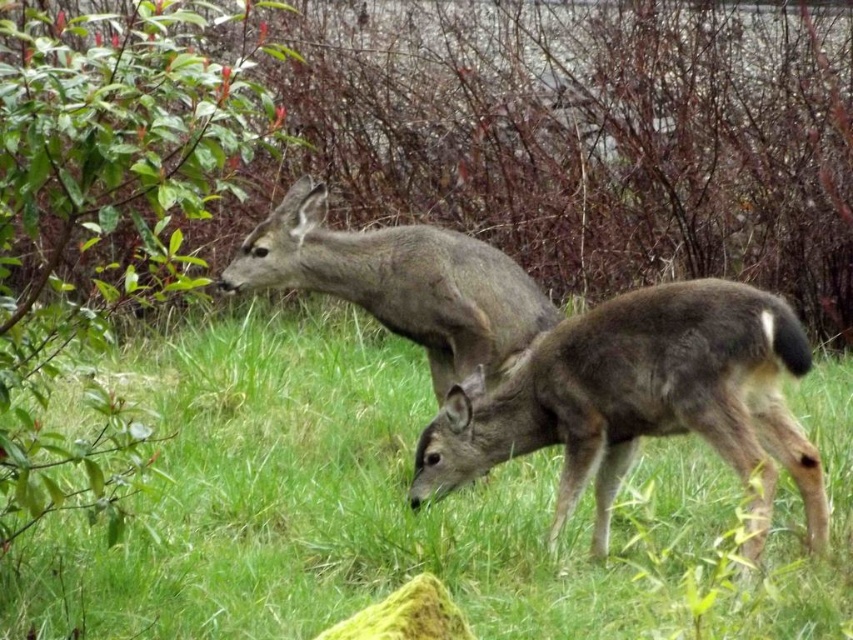
Question: Is green grassy at center behind brown fur roe deer at center?

Choices:
 (A) yes
 (B) no

Answer: (B)

Question: Among these objects, which one is nearest to the camera?

Choices:
 (A) gray fur roe deer at center
 (B) brown fur roe deer at center
 (C) green grassy at center

Answer: (C)

Question: Which of the following is the farthest from the observer?

Choices:
 (A) (757, 346)
 (B) (358, 428)
 (C) (469, 250)

Answer: (B)

Question: Considering the relative positions of green grassy at center and brown fur roe deer at center in the image provided, where is green grassy at center located with respect to brown fur roe deer at center?

Choices:
 (A) above
 (B) below

Answer: (A)

Question: Considering the real-world distances, which object is farthest from the green grassy at center?

Choices:
 (A) gray fur roe deer at center
 (B) brown fur roe deer at center

Answer: (A)

Question: From the image, what is the correct spatial relationship of brown fur roe deer at center in relation to gray fur roe deer at center?

Choices:
 (A) left
 (B) right

Answer: (B)